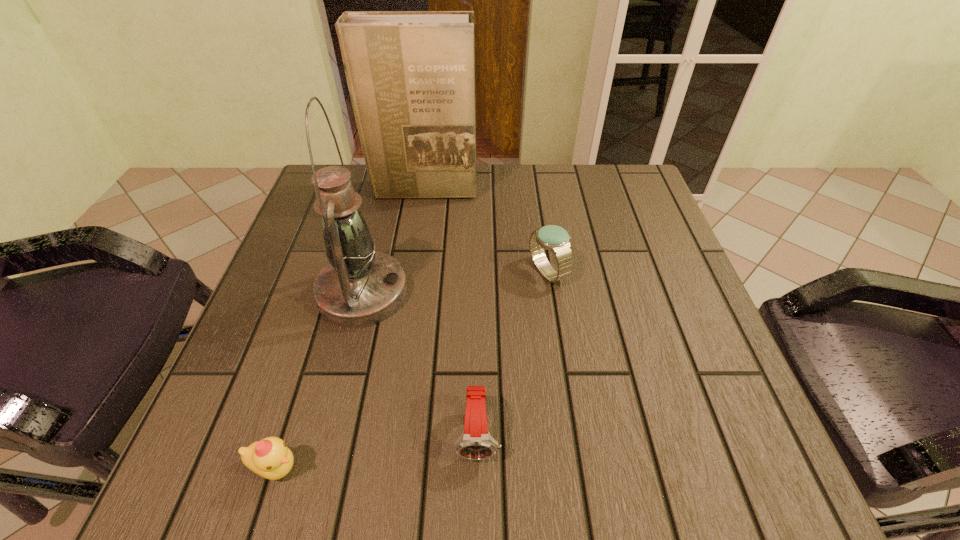
This screenshot has height=540, width=960. In order to click on blank space at the left edge of the desktop in this screenshot , I will do `click(272, 288)`.

This screenshot has width=960, height=540. Identify the location of vacant space at the right edge of the desktop. (692, 291).

The width and height of the screenshot is (960, 540). Identify the location of blank space at the near left corner. (245, 434).

In order to click on vacant space at the near right corner of the desktop in this screenshot , I will do `click(667, 449)`.

Locate an element on the screen. The image size is (960, 540). blank region between the oil lamp and the farther watch is located at coordinates (455, 282).

Where is `vacant area that lies between the rightmost object and the phonebook`? Image resolution: width=960 pixels, height=540 pixels. vacant area that lies between the rightmost object and the phonebook is located at coordinates (486, 231).

You are a GUI agent. You are given a task and a screenshot of the screen. Output one action in this format:
    pyautogui.click(x=<x>, y=<y>)
    Task: Click on the free spot between the phonebook and the oil lamp
    Image resolution: width=960 pixels, height=540 pixels.
    Given the screenshot: What is the action you would take?
    pyautogui.click(x=394, y=241)

This screenshot has height=540, width=960. In order to click on free area in between the duckling and the nearer watch in this screenshot , I will do pos(376,451).

Where is `vacant space that's between the nearer watch and the oil lamp`? vacant space that's between the nearer watch and the oil lamp is located at coordinates (420, 363).

You are a GUI agent. You are given a task and a screenshot of the screen. Output one action in this format:
    pyautogui.click(x=<x>, y=<y>)
    Task: Click on the blank region between the oil lamp and the right watch
    
    Given the screenshot: What is the action you would take?
    pyautogui.click(x=455, y=282)